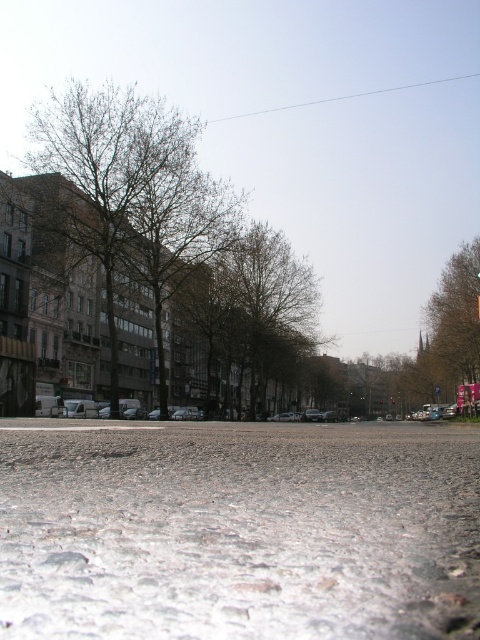
You are standing on the road and want to take a photo of the brown leafless tree at left. Where should you position yourself to capture the tree at the coordinates point (152, 256)?

To capture the brown leafless tree at left at the coordinates point (152, 256), you should position yourself on the road at the same coordinates as the tree, ensuring the camera is aligned with its location.

You are a photographer trying to capture a photo of both the brown leafless tree at left and the brown leafy tree at right. Based on their heights, which tree should you focus on first to ensure both are in the frame?

The brown leafless tree at left is taller than the brown leafy tree at right, so you should focus on the brown leafless tree at left first to ensure both are in the frame.

You are a photographer trying to capture a closeup of the white granular snow at center and the brown leafy tree at right in the same frame. Based on their positions, will the tree appear smaller or larger in the photo compared to the snow?

The white granular snow at center is closer to the viewer than the brown leafy tree at right, so the tree will appear smaller in the photo compared to the snow.